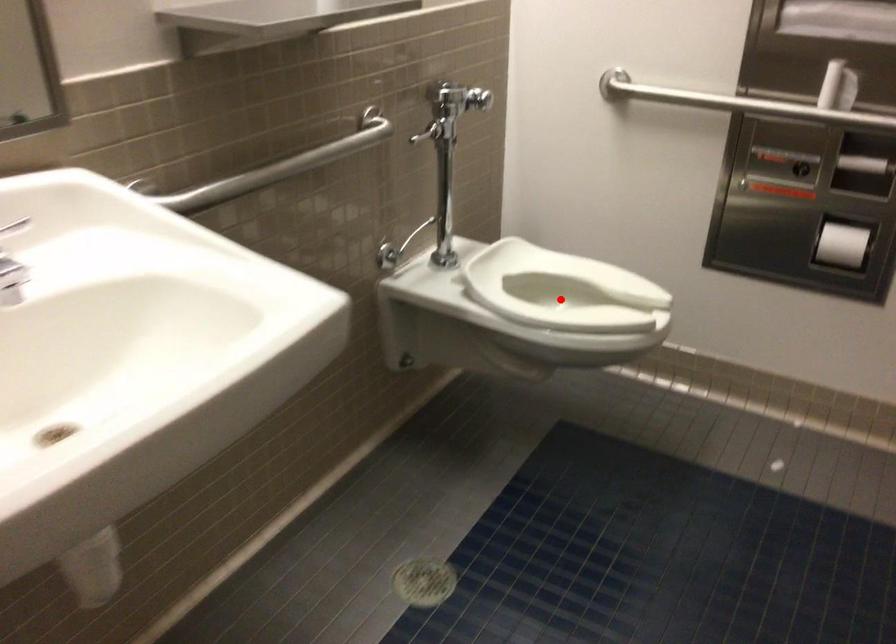
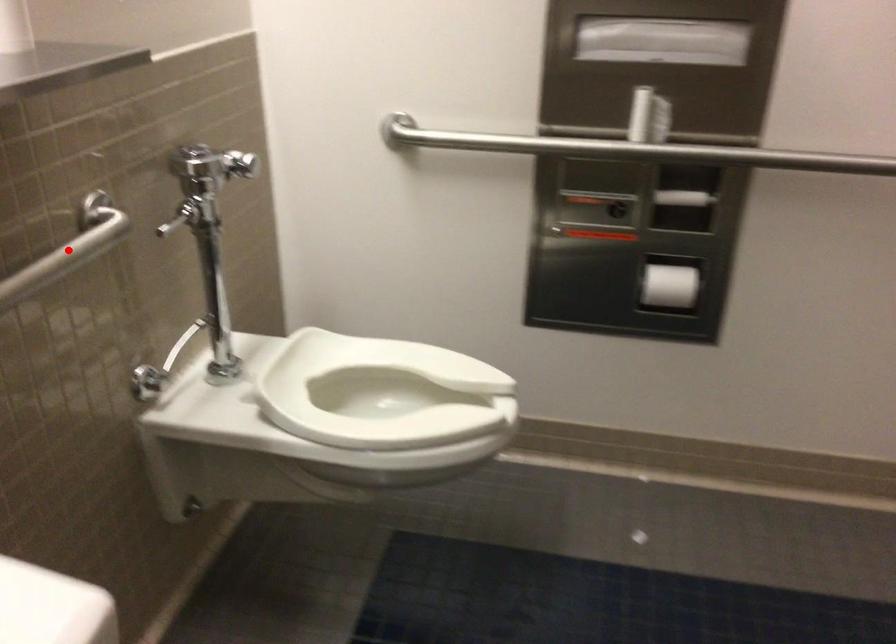
I am providing you with two images of the same scene from different viewpoints. A red point is marked on the first image and another point is marked on the second image. Do the highlighted points in image1 and image2 indicate the same real-world spot?

No